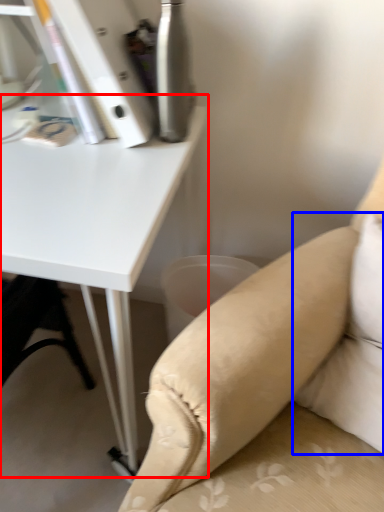
Question: Which point is further to the camera, table (highlighted by a red box) or pillow (highlighted by a blue box)?

Choices:
 (A) table
 (B) pillow

Answer: (A)